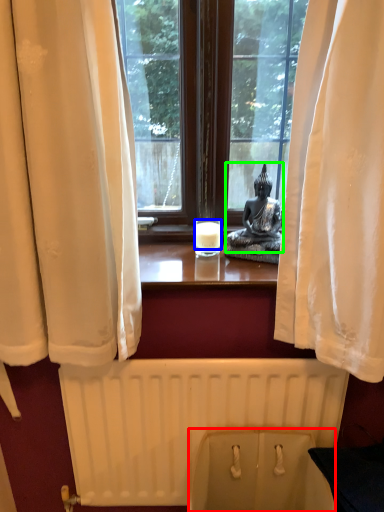
Question: Based on their relative distances, which object is nearer to toilet bowl (highlighted by a red box)? Choose from candle (highlighted by a blue box) and person (highlighted by a green box).

Choices:
 (A) candle
 (B) person

Answer: (B)